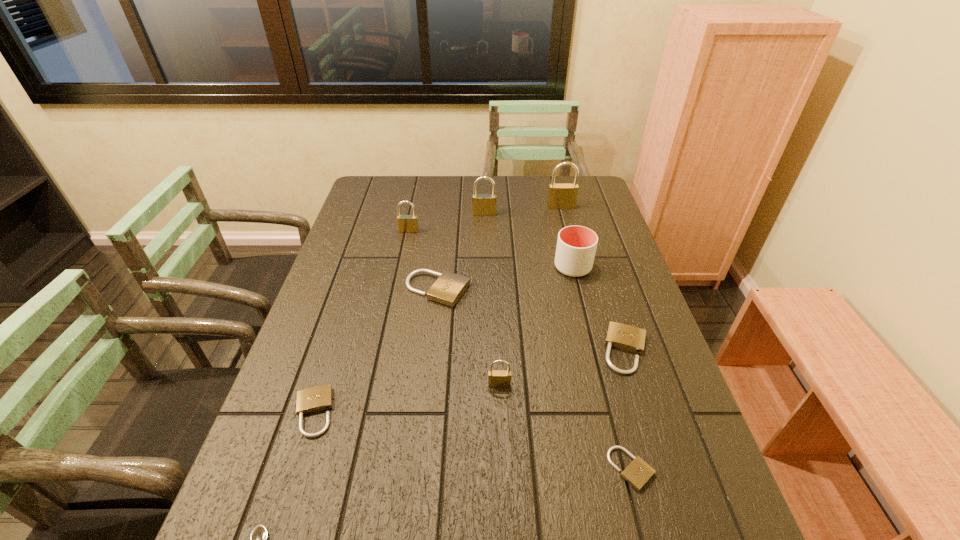
Where is `vacant space situated on the front of the white cup`? The height and width of the screenshot is (540, 960). vacant space situated on the front of the white cup is located at coordinates (591, 340).

I want to click on vacant space situated 0.270m on the front-facing side of the sixth shortest object, so click(x=504, y=509).

Locate an element on the screen. This screenshot has height=540, width=960. vacant space positioned on the right of the fourth shortest padlock is located at coordinates (488, 290).

The width and height of the screenshot is (960, 540). I want to click on vacant space situated 0.140m on the back of the fourth nearest padlock, so click(607, 291).

Where is `vacant space located 0.260m on the back of the leftmost beige padlock`? Image resolution: width=960 pixels, height=540 pixels. vacant space located 0.260m on the back of the leftmost beige padlock is located at coordinates (347, 309).

This screenshot has width=960, height=540. Identify the location of vacant position located on the back of the smallest beige padlock. (602, 356).

Identify the location of object that is at the far edge. (560, 196).

I want to click on object located at the left edge, so click(x=315, y=399).

The image size is (960, 540). Find the location of `cup present at the right edge`. cup present at the right edge is located at coordinates (576, 245).

Find the location of a particular element. This screenshot has width=960, height=540. object that is at the far right corner is located at coordinates [560, 196].